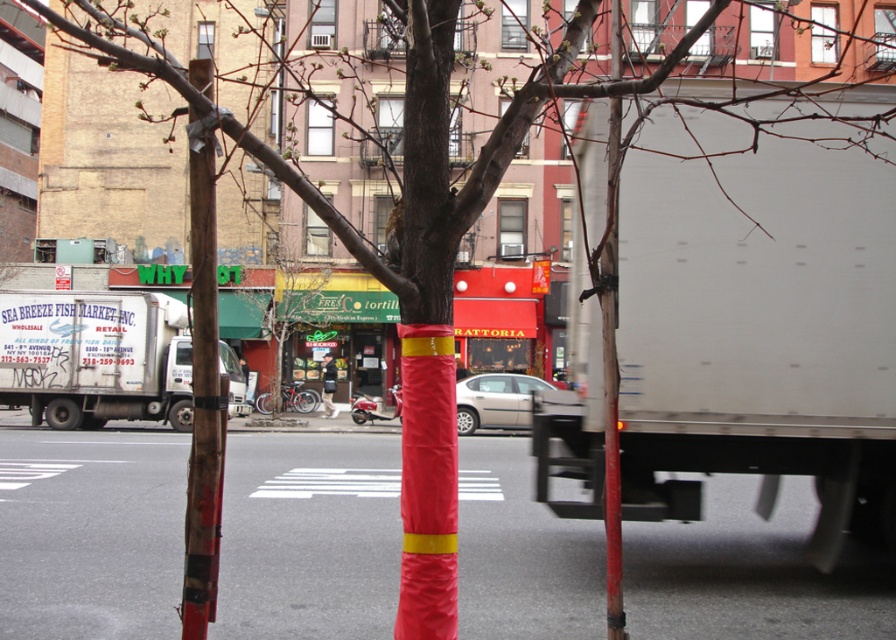
Does white matte truck at right appear under red plastic pole at center?

No.

Who is more forward, (635,308) or (613,99)?

Point (613,99)

You are a GUI agent. You are given a task and a screenshot of the screen. Output one action in this format:
    pyautogui.click(x=<x>, y=<y>)
    Task: Click on the white matte truck at right
    The image size is (896, 640).
    Given the screenshot: What is the action you would take?
    pyautogui.click(x=760, y=305)

Which is behind, point (619, 532) or point (287, 368)?

Positioned behind is point (287, 368).

Is point (616, 440) positioned before point (261, 385)?

Yes, it is.

The width and height of the screenshot is (896, 640). I want to click on red plastic pole at center, so click(610, 381).

The height and width of the screenshot is (640, 896). Find the location of `red plastic pole at center`. red plastic pole at center is located at coordinates (610, 381).

Is white metallic truck at left taller than wooden pole at center?

Correct, white metallic truck at left is much taller as wooden pole at center.

Is white metallic truck at left closer to camera compared to wooden pole at center?

That is False.

Between point (220, 369) and point (200, 294), which one is positioned in front?

Positioned in front is point (200, 294).

Where is `white metallic truck at left`? The width and height of the screenshot is (896, 640). white metallic truck at left is located at coordinates (95, 356).